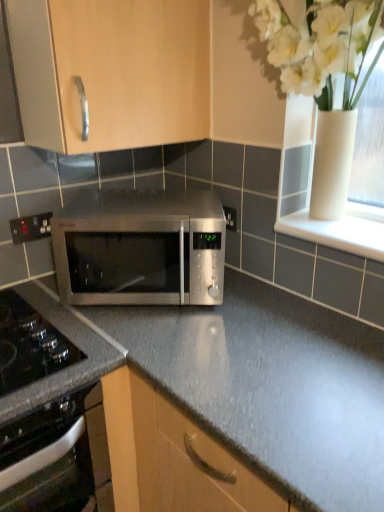
Question: From a real-world perspective, does black glass oven at lower left stand above matte wood cabinet at upper center?

Choices:
 (A) no
 (B) yes

Answer: (A)

Question: From a real-world perspective, is black glass oven at lower left physically below matte wood cabinet at upper center?

Choices:
 (A) yes
 (B) no

Answer: (A)

Question: Does black glass oven at lower left have a greater height compared to matte wood cabinet at upper center?

Choices:
 (A) no
 (B) yes

Answer: (B)

Question: Is black glass oven at lower left positioned with its back to matte wood cabinet at upper center?

Choices:
 (A) no
 (B) yes

Answer: (A)

Question: Can you confirm if black glass oven at lower left is wider than matte wood cabinet at upper center?

Choices:
 (A) no
 (B) yes

Answer: (B)

Question: Is black glass oven at lower left further to camera compared to matte wood cabinet at upper center?

Choices:
 (A) no
 (B) yes

Answer: (A)

Question: Is black glass oven at lower left at the right side of stainless steel microwave at center?

Choices:
 (A) no
 (B) yes

Answer: (A)

Question: Can you confirm if black glass oven at lower left is thinner than stainless steel microwave at center?

Choices:
 (A) yes
 (B) no

Answer: (B)

Question: Does black glass oven at lower left turn towards stainless steel microwave at center?

Choices:
 (A) no
 (B) yes

Answer: (A)

Question: Can you confirm if black glass oven at lower left is smaller than stainless steel microwave at center?

Choices:
 (A) no
 (B) yes

Answer: (A)

Question: Is black glass oven at lower left facing away from stainless steel microwave at center?

Choices:
 (A) no
 (B) yes

Answer: (A)

Question: Is black glass oven at lower left closer to the viewer compared to stainless steel microwave at center?

Choices:
 (A) no
 (B) yes

Answer: (B)

Question: Would you say white glossy window sill at upper right contains black glass oven at lower left?

Choices:
 (A) yes
 (B) no

Answer: (B)